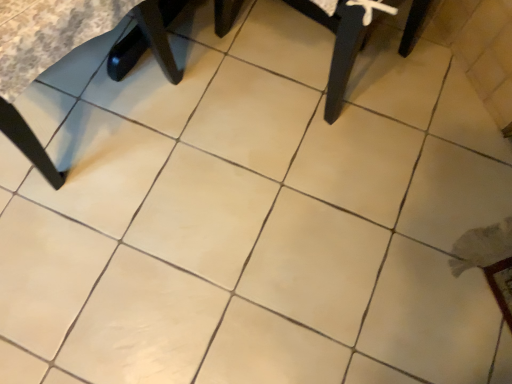
This screenshot has height=384, width=512. In order to click on matte black table leg at left in this screenshot , I will do `click(44, 56)`.

The height and width of the screenshot is (384, 512). What do you see at coordinates (44, 56) in the screenshot?
I see `matte black table leg at left` at bounding box center [44, 56].

The width and height of the screenshot is (512, 384). Identify the location of matte black table leg at left. pyautogui.click(x=44, y=56).